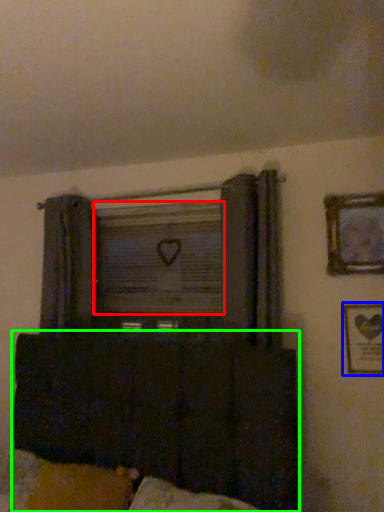
Question: Considering the real-world distances, which object is farthest from window screen (highlighted by a red box)? picture frame (highlighted by a blue box) or furniture (highlighted by a green box)?

Choices:
 (A) picture frame
 (B) furniture

Answer: (A)